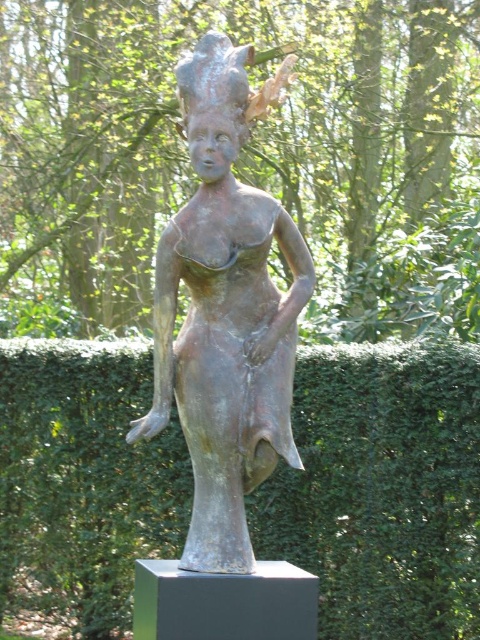
You are a visitor in a garden and see the green leafy hedge at center and the bronze statue at center. Which object is positioned more to the left side of the garden?

The green leafy hedge at center is positioned more to the left side of the garden than the bronze statue at center.